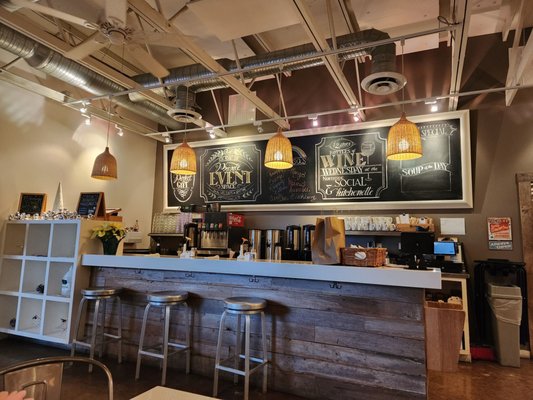
Identify the location of bar stools. (237, 321), (164, 304), (88, 294).